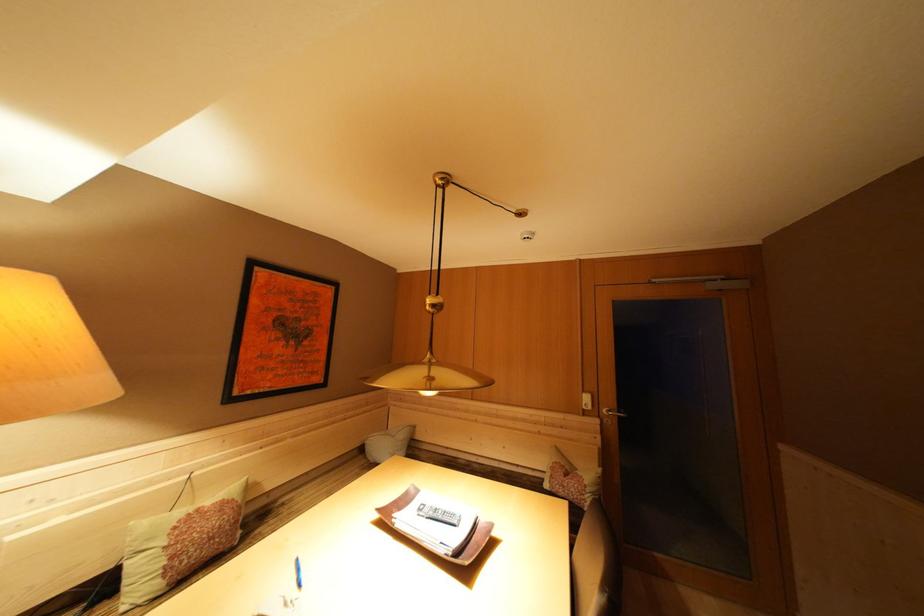
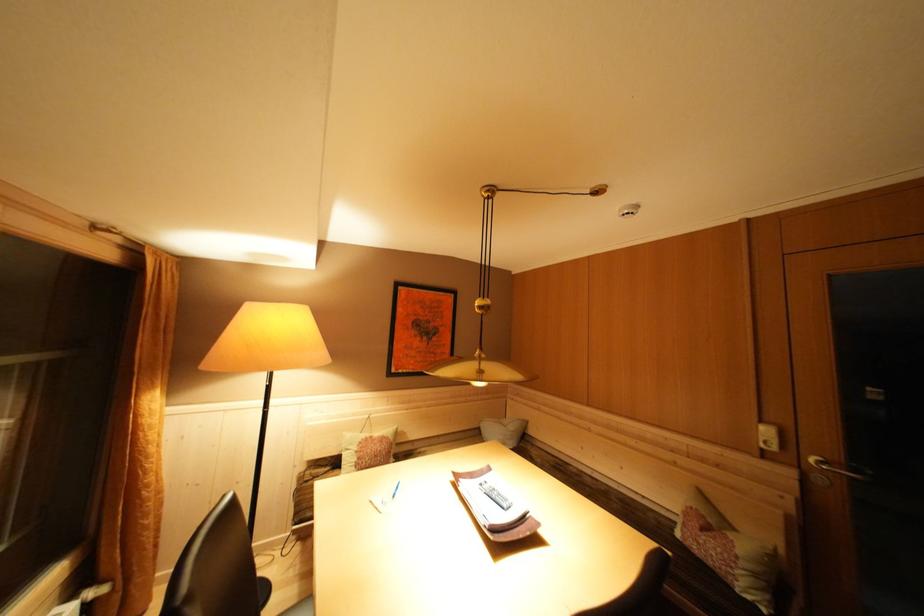
Locate, in the second image, the point that corresponds to (x=611, y=416) in the first image.

(819, 466)